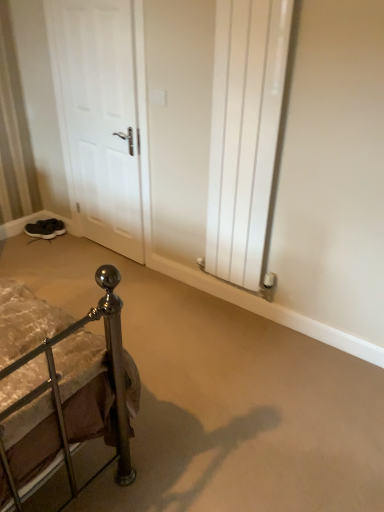
Question: Can you see dark gray suede sneakers at lower left, the 1th footwear in the front-to-back sequence, touching white matte door at left?

Choices:
 (A) no
 (B) yes

Answer: (A)

Question: Considering the relative sizes of dark gray suede sneakers at lower left, which appears as the 2th footwear when viewed from the back, and white matte door at left in the image provided, is dark gray suede sneakers at lower left, which appears as the 2th footwear when viewed from the back, wider than white matte door at left?

Choices:
 (A) no
 (B) yes

Answer: (B)

Question: Considering the relative sizes of dark gray suede sneakers at lower left, which appears as the 2th footwear when viewed from the back, and white matte door at left in the image provided, is dark gray suede sneakers at lower left, which appears as the 2th footwear when viewed from the back, shorter than white matte door at left?

Choices:
 (A) no
 (B) yes

Answer: (B)

Question: Is dark gray suede sneakers at lower left, which appears as the 2th footwear when viewed from the back, thinner than white matte door at left?

Choices:
 (A) no
 (B) yes

Answer: (A)

Question: Is dark gray suede sneakers at lower left, the 1th footwear in the front-to-back sequence, smaller than white matte door at left?

Choices:
 (A) no
 (B) yes

Answer: (B)

Question: From the image's perspective, is white matte door at left positioned above or below black suede shoes at lower left, which is the first footwear from back to front?

Choices:
 (A) above
 (B) below

Answer: (A)

Question: Would you say white matte door at left is to the left or to the right of black suede shoes at lower left, which is the first footwear from back to front, in the picture?

Choices:
 (A) left
 (B) right

Answer: (B)

Question: From their relative heights in the image, would you say white matte door at left is taller or shorter than black suede shoes at lower left, the 2th footwear in the front-to-back sequence?

Choices:
 (A) short
 (B) tall

Answer: (B)

Question: In terms of width, does white matte door at left look wider or thinner when compared to black suede shoes at lower left, which is the first footwear from back to front?

Choices:
 (A) wide
 (B) thin

Answer: (B)

Question: From the image's perspective, relative to dark gray suede sneakers at lower left, which appears as the 2th footwear when viewed from the back, is white matte door at left above or below?

Choices:
 (A) above
 (B) below

Answer: (A)

Question: Considering the relative positions of white matte door at left and dark gray suede sneakers at lower left, which appears as the 2th footwear when viewed from the back, in the image provided, is white matte door at left to the left or to the right of dark gray suede sneakers at lower left, which appears as the 2th footwear when viewed from the back,?

Choices:
 (A) right
 (B) left

Answer: (A)

Question: Choose the correct answer: Is white matte door at left inside dark gray suede sneakers at lower left, the 1th footwear in the front-to-back sequence, or outside it?

Choices:
 (A) outside
 (B) inside

Answer: (A)

Question: Is white matte door at left bigger or smaller than dark gray suede sneakers at lower left, which appears as the 2th footwear when viewed from the back?

Choices:
 (A) small
 (B) big

Answer: (B)

Question: From a real-world perspective, is black suede shoes at lower left, the 2th footwear in the front-to-back sequence, positioned above or below white matte door at left?

Choices:
 (A) below
 (B) above

Answer: (A)

Question: Relative to white matte door at left, is black suede shoes at lower left, which is the first footwear from back to front, in front or behind?

Choices:
 (A) behind
 (B) front

Answer: (A)